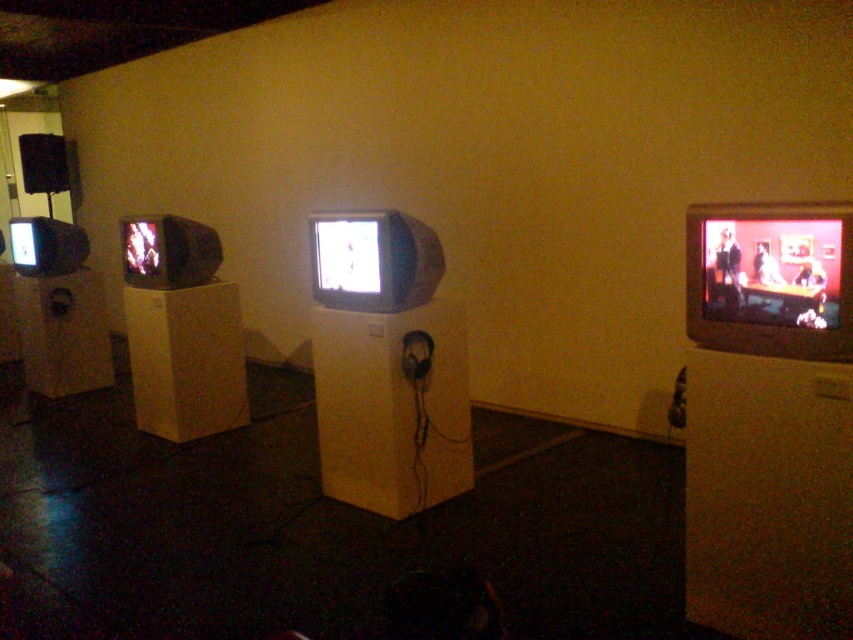
This screenshot has width=853, height=640. Describe the element at coordinates (770, 280) in the screenshot. I see `matte black flat screen tv at right` at that location.

Is point (732, 337) behind point (363, 236)?

That is False.

This screenshot has height=640, width=853. Find the location of `matte black flat screen tv at right`. matte black flat screen tv at right is located at coordinates (770, 280).